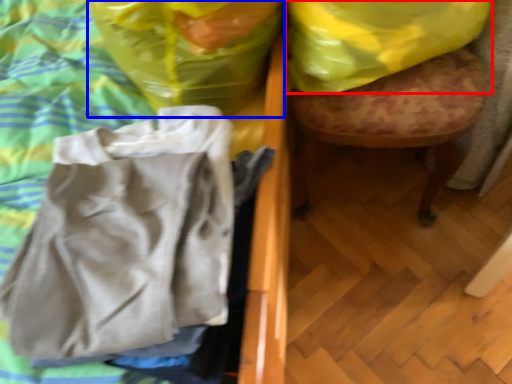
Question: Among these objects, which one is farthest to the camera, plastic bag (highlighted by a red box) or plastic bag (highlighted by a blue box)?

Choices:
 (A) plastic bag
 (B) plastic bag

Answer: (A)